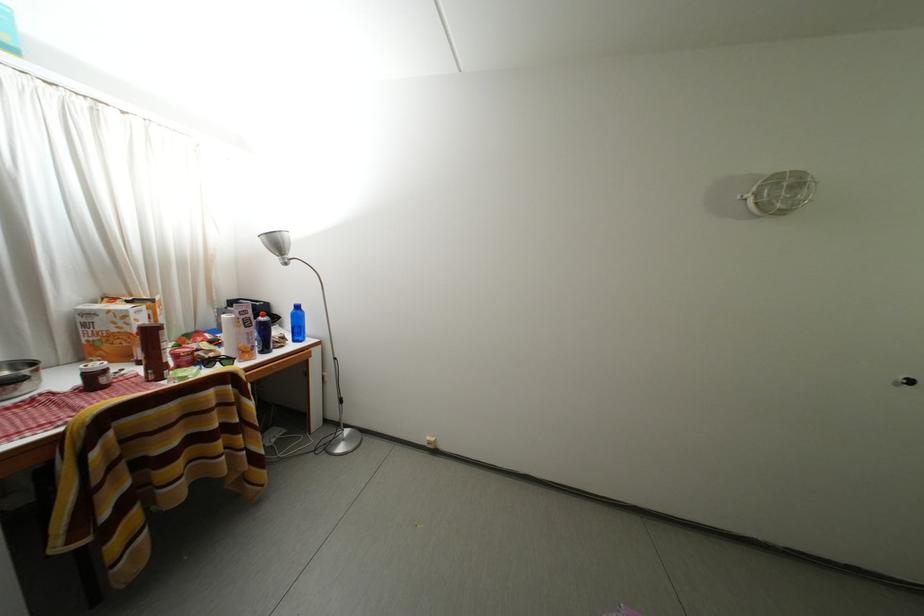
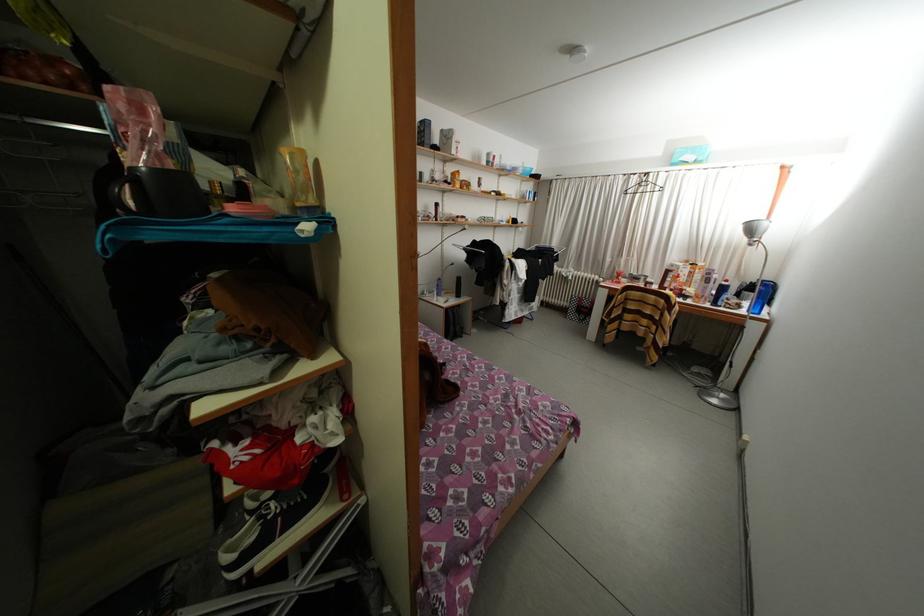
In the second image, find the point that corresponds to the point at 292,344 in the first image.

(747, 310)